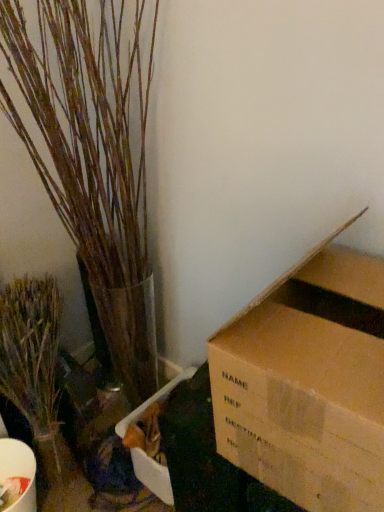
Where is `bark-like textured plant at left, which is the first houseplant in right-to-left order`? The width and height of the screenshot is (384, 512). bark-like textured plant at left, which is the first houseplant in right-to-left order is located at coordinates (92, 165).

Measure the distance between point (128, 170) and camera.

The distance of point (128, 170) from camera is 4.31 feet.

Describe the element at coordinates (92, 165) in the screenshot. This screenshot has width=384, height=512. I see `bark-like textured plant at left, which is the first houseplant in right-to-left order` at that location.

How much space does green matte plant at left, acting as the 1th houseplant starting from the left, occupy horizontally?

It is 12.00 inches.

Locate an element on the screen. The image size is (384, 512). green matte plant at left, positioned as the 2th houseplant in right-to-left order is located at coordinates (35, 365).

The image size is (384, 512). What do you see at coordinates (35, 365) in the screenshot? I see `green matte plant at left, positioned as the 2th houseplant in right-to-left order` at bounding box center [35, 365].

You are a GUI agent. You are given a task and a screenshot of the screen. Output one action in this format:
    pyautogui.click(x=<x>, y=<y>)
    Task: Click on the bark-like textured plant at left, the 2th houseplant in the left-to-right sequence
    The width and height of the screenshot is (384, 512).
    Given the screenshot: What is the action you would take?
    pyautogui.click(x=92, y=165)

Which is more to the left, bark-like textured plant at left, the 2th houseplant in the left-to-right sequence, or green matte plant at left, positioned as the 2th houseplant in right-to-left order?

green matte plant at left, positioned as the 2th houseplant in right-to-left order.

Is bark-like textured plant at left, the 2th houseplant in the left-to-right sequence, positioned before green matte plant at left, positioned as the 2th houseplant in right-to-left order?

Yes, the depth of bark-like textured plant at left, the 2th houseplant in the left-to-right sequence, is less than that of green matte plant at left, positioned as the 2th houseplant in right-to-left order.

Between point (76, 193) and point (28, 358), which one is positioned behind?

The point (76, 193) is farther from the camera.

From the image's perspective, is bark-like textured plant at left, the 2th houseplant in the left-to-right sequence, beneath green matte plant at left, positioned as the 2th houseplant in right-to-left order?

Incorrect, from the image's perspective, bark-like textured plant at left, the 2th houseplant in the left-to-right sequence, is higher than green matte plant at left, positioned as the 2th houseplant in right-to-left order.

From a real-world perspective, is bark-like textured plant at left, which is the first houseplant in right-to-left order, above or below green matte plant at left, acting as the 1th houseplant starting from the left?

Clearly, from a real-world perspective, bark-like textured plant at left, which is the first houseplant in right-to-left order, is above green matte plant at left, acting as the 1th houseplant starting from the left.

Is bark-like textured plant at left, which is the first houseplant in right-to-left order, wider or thinner than green matte plant at left, acting as the 1th houseplant starting from the left?

In the image, bark-like textured plant at left, which is the first houseplant in right-to-left order, appears to be wider than green matte plant at left, acting as the 1th houseplant starting from the left.

Between bark-like textured plant at left, the 2th houseplant in the left-to-right sequence, and green matte plant at left, acting as the 1th houseplant starting from the left, which one has more height?

bark-like textured plant at left, the 2th houseplant in the left-to-right sequence, is taller.

Does bark-like textured plant at left, the 2th houseplant in the left-to-right sequence, have a smaller size compared to green matte plant at left, acting as the 1th houseplant starting from the left?

Incorrect, bark-like textured plant at left, the 2th houseplant in the left-to-right sequence, is not smaller in size than green matte plant at left, acting as the 1th houseplant starting from the left.

Is bark-like textured plant at left, which is the first houseplant in right-to-left order, spatially inside green matte plant at left, positioned as the 2th houseplant in right-to-left order, or outside of it?

bark-like textured plant at left, which is the first houseplant in right-to-left order, is outside green matte plant at left, positioned as the 2th houseplant in right-to-left order.

Is bark-like textured plant at left, which is the first houseplant in right-to-left order, with green matte plant at left, acting as the 1th houseplant starting from the left?

There is a gap between bark-like textured plant at left, which is the first houseplant in right-to-left order, and green matte plant at left, acting as the 1th houseplant starting from the left.

Is bark-like textured plant at left, which is the first houseplant in right-to-left order, turned away from green matte plant at left, positioned as the 2th houseplant in right-to-left order?

No, green matte plant at left, positioned as the 2th houseplant in right-to-left order, is not at the back of bark-like textured plant at left, which is the first houseplant in right-to-left order.

How different are the orientations of bark-like textured plant at left, the 2th houseplant in the left-to-right sequence, and green matte plant at left, acting as the 1th houseplant starting from the left, in degrees?

0.000445 degrees separate the facing orientations of bark-like textured plant at left, the 2th houseplant in the left-to-right sequence, and green matte plant at left, acting as the 1th houseplant starting from the left.

Measure the distance from bark-like textured plant at left, the 2th houseplant in the left-to-right sequence, to green matte plant at left, acting as the 1th houseplant starting from the left.

bark-like textured plant at left, the 2th houseplant in the left-to-right sequence, and green matte plant at left, acting as the 1th houseplant starting from the left, are 15.75 inches apart from each other.

I want to click on houseplant above the green matte plant at left, acting as the 1th houseplant starting from the left (from the image's perspective), so click(x=92, y=165).

Between green matte plant at left, positioned as the 2th houseplant in right-to-left order, and bark-like textured plant at left, which is the first houseplant in right-to-left order, which one appears on the right side from the viewer's perspective?

bark-like textured plant at left, which is the first houseplant in right-to-left order.

Which object is more forward, green matte plant at left, acting as the 1th houseplant starting from the left, or bark-like textured plant at left, which is the first houseplant in right-to-left order?

bark-like textured plant at left, which is the first houseplant in right-to-left order, is closer to the camera.

Is point (40, 453) farther from camera compared to point (124, 387)?

No, (40, 453) is closer to viewer.

From the image's perspective, which object appears higher, green matte plant at left, positioned as the 2th houseplant in right-to-left order, or bark-like textured plant at left, which is the first houseplant in right-to-left order?

bark-like textured plant at left, which is the first houseplant in right-to-left order, appears higher in the image.

From a real-world perspective, is green matte plant at left, acting as the 1th houseplant starting from the left, above or below bark-like textured plant at left, which is the first houseplant in right-to-left order?

In terms of real-world spatial position, green matte plant at left, acting as the 1th houseplant starting from the left, is below bark-like textured plant at left, which is the first houseplant in right-to-left order.

Between green matte plant at left, acting as the 1th houseplant starting from the left, and bark-like textured plant at left, which is the first houseplant in right-to-left order, which one has smaller width?

With smaller width is green matte plant at left, acting as the 1th houseplant starting from the left.

Which of these two, green matte plant at left, acting as the 1th houseplant starting from the left, or bark-like textured plant at left, which is the first houseplant in right-to-left order, stands taller?

Standing taller between the two is bark-like textured plant at left, which is the first houseplant in right-to-left order.

Considering the sizes of objects green matte plant at left, positioned as the 2th houseplant in right-to-left order, and bark-like textured plant at left, the 2th houseplant in the left-to-right sequence, in the image provided, who is smaller, green matte plant at left, positioned as the 2th houseplant in right-to-left order, or bark-like textured plant at left, the 2th houseplant in the left-to-right sequence,?

green matte plant at left, positioned as the 2th houseplant in right-to-left order, is smaller.

Does green matte plant at left, acting as the 1th houseplant starting from the left, contain bark-like textured plant at left, which is the first houseplant in right-to-left order?

No, bark-like textured plant at left, which is the first houseplant in right-to-left order, is located outside of green matte plant at left, acting as the 1th houseplant starting from the left.

Is there a large distance between green matte plant at left, positioned as the 2th houseplant in right-to-left order, and bark-like textured plant at left, the 2th houseplant in the left-to-right sequence?

No.

Is green matte plant at left, positioned as the 2th houseplant in right-to-left order, oriented away from bark-like textured plant at left, which is the first houseplant in right-to-left order?

No.

Image resolution: width=384 pixels, height=512 pixels. Find the location of `houseplant that appears on the left of bark-like textured plant at left, which is the first houseplant in right-to-left order`. houseplant that appears on the left of bark-like textured plant at left, which is the first houseplant in right-to-left order is located at coordinates (35, 365).

Locate an element on the screen. This screenshot has width=384, height=512. houseplant that appears above the green matte plant at left, positioned as the 2th houseplant in right-to-left order (from the image's perspective) is located at coordinates (92, 165).

At what (x,y) coordinates should I click in order to perform the action: click on houseplant located above the green matte plant at left, acting as the 1th houseplant starting from the left (from a real-world perspective). Please return your answer as a coordinate pair (x, y). Image resolution: width=384 pixels, height=512 pixels. Looking at the image, I should click on (92, 165).